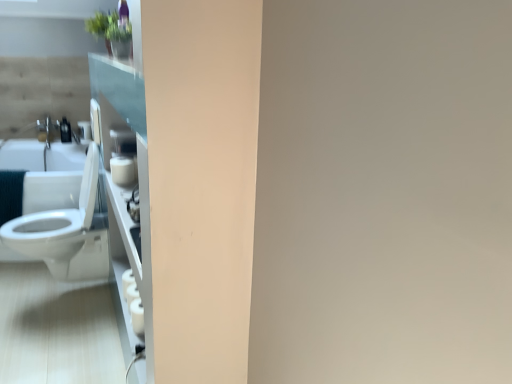
The height and width of the screenshot is (384, 512). I want to click on white glossy sink at left, so click(42, 155).

Image resolution: width=512 pixels, height=384 pixels. What do you see at coordinates (42, 155) in the screenshot?
I see `white glossy sink at left` at bounding box center [42, 155].

Where is `white glossy toilet at left`? The height and width of the screenshot is (384, 512). white glossy toilet at left is located at coordinates (63, 224).

This screenshot has width=512, height=384. Describe the element at coordinates (127, 281) in the screenshot. I see `white matte toilet paper at lower left` at that location.

Identify the location of white glossy sink at left. The height and width of the screenshot is (384, 512). (42, 155).

Does point (71, 134) come in front of point (130, 283)?

No.

Locate an element on the screen. toiletry above the white matte toilet paper at lower left (from a real-world perspective) is located at coordinates (65, 131).

Is the depth of matte white soap dispenser at left less than that of white matte toilet paper at lower left?

No, matte white soap dispenser at left is further to the viewer.

Is there a large distance between matte white soap dispenser at left and white matte toilet paper at lower left?

Yes.

How many degrees apart are the facing directions of white glossy toilet at left and matte white soap dispenser at left?

white glossy toilet at left and matte white soap dispenser at left are facing 0.000246 degrees away from each other.

From a real-world perspective, is white glossy toilet at left positioned above or below matte white soap dispenser at left?

Clearly, from a real-world perspective, white glossy toilet at left is below matte white soap dispenser at left.

Is white glossy toilet at left not close to matte white soap dispenser at left?

Absolutely, white glossy toilet at left is distant from matte white soap dispenser at left.

Can you confirm if white glossy toilet at left is smaller than matte white soap dispenser at left?

No.

You are a GUI agent. You are given a task and a screenshot of the screen. Output one action in this format:
    pyautogui.click(x=<x>, y=<y>)
    Task: Click on the toiletry behind the white glossy sink at left
    
    Given the screenshot: What is the action you would take?
    pyautogui.click(x=65, y=131)

Does white glossy sink at left touch matte white soap dispenser at left?

No, white glossy sink at left is not beside matte white soap dispenser at left.

From their relative heights in the image, would you say white glossy sink at left is taller or shorter than matte white soap dispenser at left?

In the image, white glossy sink at left appears to be taller than matte white soap dispenser at left.

Looking at this image, does white glossy toilet at left appear on the right side of white matte toilet paper at lower left?

In fact, white glossy toilet at left is to the left of white matte toilet paper at lower left.

Would you say white glossy toilet at left is a long distance from white matte toilet paper at lower left?

No, white glossy toilet at left is in close proximity to white matte toilet paper at lower left.

From a real-world perspective, is white glossy toilet at left physically above white matte toilet paper at lower left?

No, from a real-world perspective, white glossy toilet at left is not on top of white matte toilet paper at lower left.

Image resolution: width=512 pixels, height=384 pixels. Identify the location of toilet paper in front of the white glossy toilet at left. (127, 281).

Considering the sizes of objects white glossy sink at left and white matte toilet paper at lower left in the image provided, who is thinner, white glossy sink at left or white matte toilet paper at lower left?

Thinner between the two is white matte toilet paper at lower left.

Are white glossy sink at left and white matte toilet paper at lower left far apart?

Yes, white glossy sink at left and white matte toilet paper at lower left are located far from each other.

Is white glossy sink at left at the left side of white matte toilet paper at lower left?

Indeed, white glossy sink at left is positioned on the left side of white matte toilet paper at lower left.

Is point (65, 167) farther from camera compared to point (126, 276)?

Yes, point (65, 167) is behind point (126, 276).

Which object is positioned more to the left, white matte toilet paper at lower left or matte white soap dispenser at left?

matte white soap dispenser at left is more to the left.

Which object is further away from the camera, white matte toilet paper at lower left or matte white soap dispenser at left?

matte white soap dispenser at left is further away from the camera.

Considering the relative sizes of white matte toilet paper at lower left and matte white soap dispenser at left in the image provided, is white matte toilet paper at lower left taller than matte white soap dispenser at left?

In fact, white matte toilet paper at lower left may be shorter than matte white soap dispenser at left.

Identify the location of toilet beneath the white glossy sink at left (from a real-world perspective). (63, 224).

Looking at this image, from a real-world perspective, does white glossy sink at left stand above white glossy toilet at left?

Yes, from a real-world perspective, white glossy sink at left is on top of white glossy toilet at left.

How different are the orientations of white glossy sink at left and white glossy toilet at left in degrees?

white glossy sink at left and white glossy toilet at left are facing 0.0605 degrees away from each other.

Would you consider white glossy sink at left to be distant from white glossy toilet at left?

No, white glossy sink at left is not far away from white glossy toilet at left.

In the image, there is a matte white soap dispenser at left. Where is `toilet paper below it (from a real-world perspective)`? This screenshot has height=384, width=512. toilet paper below it (from a real-world perspective) is located at coordinates point(127,281).

Where is `toiletry above the white glossy toilet at left (from a real-world perspective)`? This screenshot has width=512, height=384. toiletry above the white glossy toilet at left (from a real-world perspective) is located at coordinates (65, 131).

Consider the image. Which object lies nearer to the anchor point white matte toilet paper at lower left, white glossy sink at left or white glossy toilet at left?

Based on the image, white glossy toilet at left appears to be nearer to white matte toilet paper at lower left.

Looking at the image, which one is located closer to matte white soap dispenser at left, white glossy sink at left or white matte toilet paper at lower left?

white glossy sink at left is closer to matte white soap dispenser at left.

Which object lies nearer to the anchor point white glossy toilet at left, matte white soap dispenser at left or white matte toilet paper at lower left?

The object closer to white glossy toilet at left is white matte toilet paper at lower left.

Estimate the real-world distances between objects in this image. Which object is closer to white glossy sink at left, matte white soap dispenser at left or white matte toilet paper at lower left?

Based on the image, matte white soap dispenser at left appears to be nearer to white glossy sink at left.

Looking at the image, which one is located further to white glossy sink at left, white glossy toilet at left or matte white soap dispenser at left?

white glossy toilet at left is further to white glossy sink at left.

From the image, which object appears to be farther from white matte toilet paper at lower left, matte white soap dispenser at left or white glossy sink at left?

matte white soap dispenser at left lies further to white matte toilet paper at lower left than the other object.

From the image, which object appears to be nearer to white glossy sink at left, white glossy toilet at left or white matte toilet paper at lower left?

Based on the image, white glossy toilet at left appears to be nearer to white glossy sink at left.

From the image, which object appears to be farther from white matte toilet paper at lower left, matte white soap dispenser at left or white glossy toilet at left?

The object further to white matte toilet paper at lower left is matte white soap dispenser at left.

Locate an element on the screen. The height and width of the screenshot is (384, 512). toilet located between white matte toilet paper at lower left and white glossy sink at left in the depth direction is located at coordinates (63, 224).

What are the coordinates of `sink positioned between white matte toilet paper at lower left and matte white soap dispenser at left from near to far` in the screenshot? It's located at (42, 155).

Where is `sink located between white glossy toilet at left and matte white soap dispenser at left in the depth direction`? The width and height of the screenshot is (512, 384). sink located between white glossy toilet at left and matte white soap dispenser at left in the depth direction is located at coordinates (42, 155).

The image size is (512, 384). What are the coordinates of `toilet between white matte toilet paper at lower left and matte white soap dispenser at left in the front-back direction` in the screenshot? It's located at (63, 224).